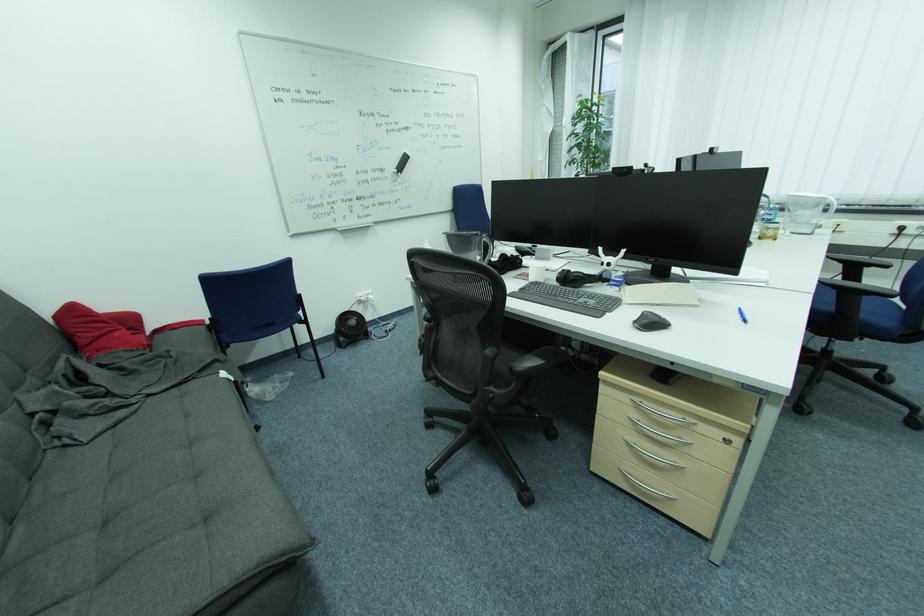
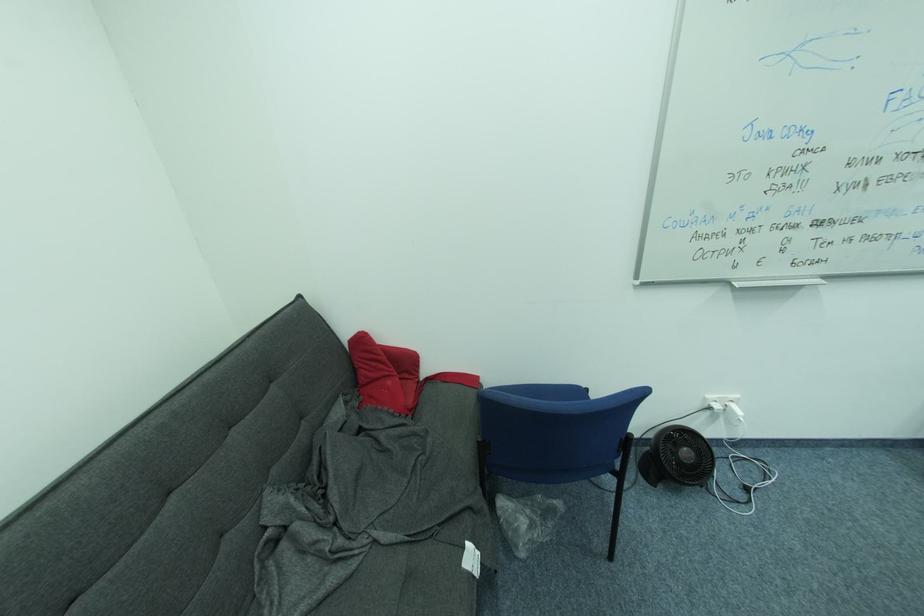
Find the pixel in the second image that matches the point at 55,312 in the first image.

(353, 336)